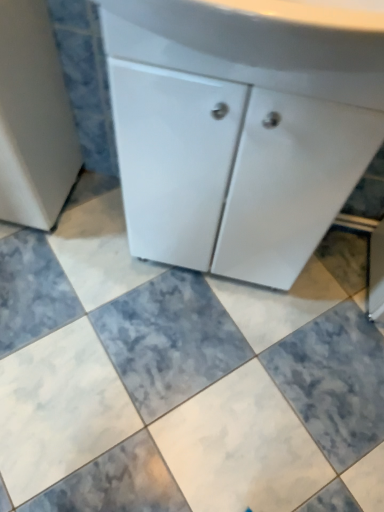
Question: Considering the relative positions of white glossy cabinet at center and marble tile at center in the image provided, is white glossy cabinet at center to the left or to the right of marble tile at center?

Choices:
 (A) left
 (B) right

Answer: (B)

Question: Based on their sizes in the image, would you say white glossy cabinet at center is bigger or smaller than marble tile at center?

Choices:
 (A) big
 (B) small

Answer: (A)

Question: Which object is positioned farthest from the marble tile at center?

Choices:
 (A) white glossy cabinet at upper center
 (B) white glossy cabinet at center

Answer: (A)

Question: Which of these objects is positioned closest to the marble tile at center?

Choices:
 (A) white glossy cabinet at upper center
 (B) white glossy cabinet at center

Answer: (B)